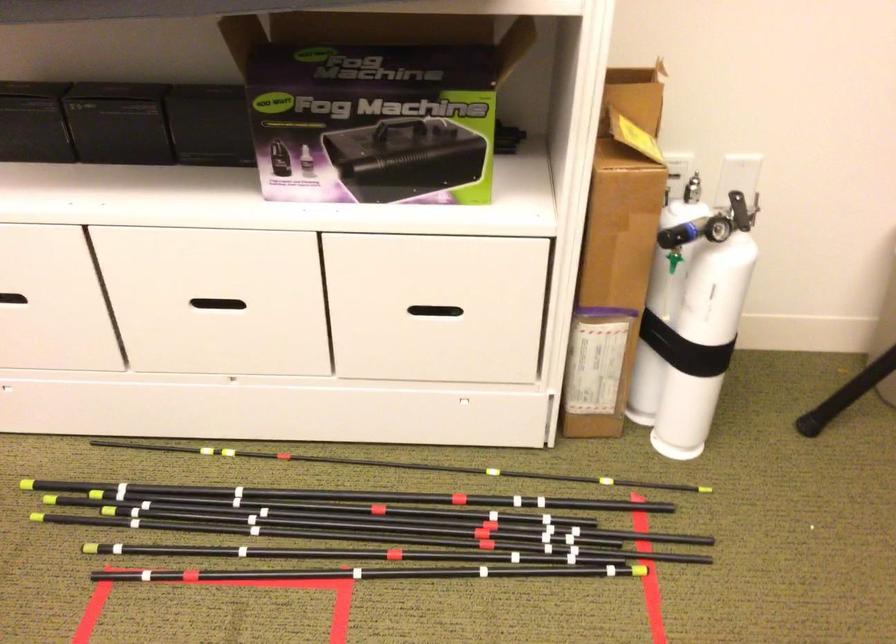
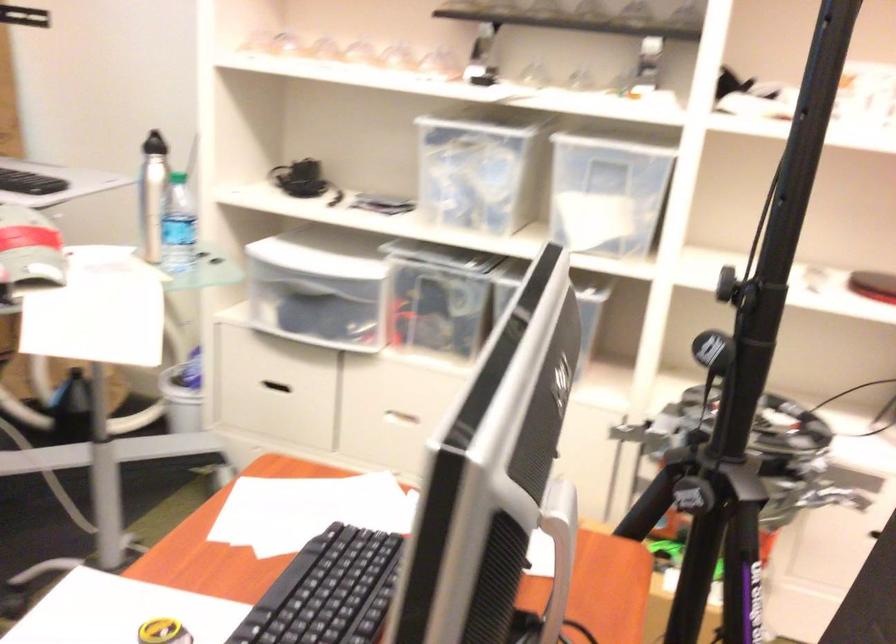
Based on the photo, the images are taken continuously from a first-person perspective. In which direction are you moving?

The cameraman walked toward left, backward.